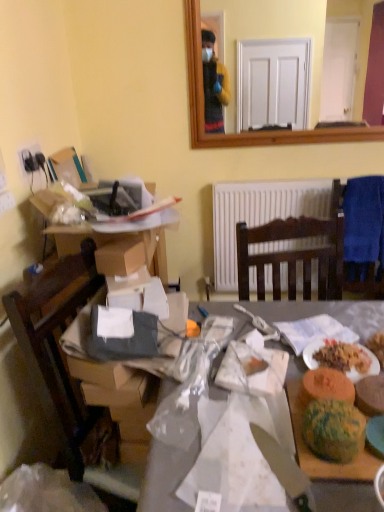
Question: Is the position of blue fabric chair at right more distant than that of green textured bread at lower right, which is counted as the 3th food, starting from the right?

Choices:
 (A) no
 (B) yes

Answer: (B)

Question: Does blue fabric chair at right have a lesser width compared to green textured bread at lower right, which is counted as the 3th food, starting from the right?

Choices:
 (A) yes
 (B) no

Answer: (A)

Question: Are blue fabric chair at right and green textured bread at lower right, the 1th food when ordered from left to right, located far from each other?

Choices:
 (A) no
 (B) yes

Answer: (B)

Question: Is blue fabric chair at right wider than green textured bread at lower right, the 1th food when ordered from left to right?

Choices:
 (A) yes
 (B) no

Answer: (B)

Question: Is blue fabric chair at right bigger than green textured bread at lower right, the 1th food when ordered from left to right?

Choices:
 (A) yes
 (B) no

Answer: (A)

Question: Is green textured bread at right, which is counted as the second food, starting from the left, wider or thinner than blue fabric chair at right?

Choices:
 (A) thin
 (B) wide

Answer: (B)

Question: Based on their positions, is green textured bread at right, which is counted as the second food, starting from the left, located to the left or right of blue fabric chair at right?

Choices:
 (A) left
 (B) right

Answer: (A)

Question: From the image's perspective, relative to blue fabric chair at right, is green textured bread at right, which is counted as the second food, starting from the left, above or below?

Choices:
 (A) above
 (B) below

Answer: (B)

Question: From a real-world perspective, is green textured bread at right, which is counted as the 2th food, starting from the right, above or below blue fabric chair at right?

Choices:
 (A) below
 (B) above

Answer: (A)

Question: In terms of size, does white paper plate at lower right appear bigger or smaller than cardboard box at left, which is the 1th desk in top-to-bottom order?

Choices:
 (A) small
 (B) big

Answer: (A)

Question: Is point (314, 350) closer or farther from the camera than point (100, 233)?

Choices:
 (A) farther
 (B) closer

Answer: (B)

Question: Based on their positions, is white paper plate at lower right located to the left or right of cardboard box at left, which is the 1th desk in top-to-bottom order?

Choices:
 (A) left
 (B) right

Answer: (B)

Question: In the image, is white paper plate at lower right positioned in front of or behind cardboard box at left, which is counted as the 2th desk, starting from the bottom?

Choices:
 (A) behind
 (B) front

Answer: (B)

Question: Does point (311, 424) appear closer or farther from the camera than point (163, 281)?

Choices:
 (A) closer
 (B) farther

Answer: (A)

Question: Would you say multicolored plastic watermelon at lower right is to the left or to the right of cardboard box at left, which is the 1th desk in top-to-bottom order, in the picture?

Choices:
 (A) left
 (B) right

Answer: (B)